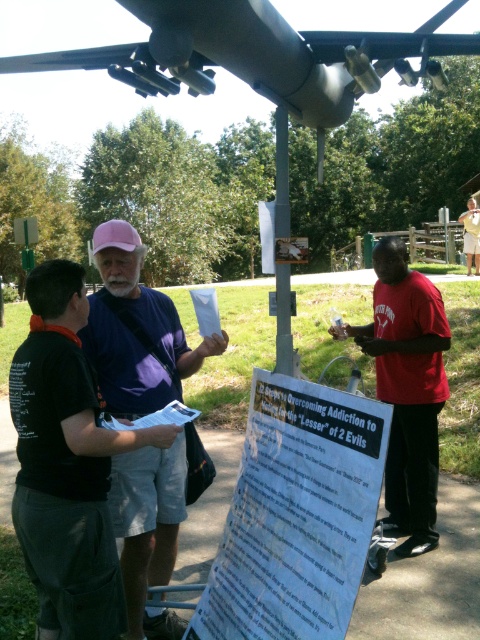
Question: Which object is farther from the camera taking this photo?

Choices:
 (A) matte red shirt at right
 (B) pink fabric cap at upper left

Answer: (A)

Question: Does pink fabric cap at upper left appear under metallic signpost at center?

Choices:
 (A) yes
 (B) no

Answer: (A)

Question: Can you confirm if matte red shirt at right is thinner than red shirt at right?

Choices:
 (A) yes
 (B) no

Answer: (A)

Question: Can you confirm if pink fabric cap at upper left is smaller than matte red shirt at right?

Choices:
 (A) no
 (B) yes

Answer: (A)

Question: Which object is the farthest from the red shirt at right?

Choices:
 (A) pink fabric cap at upper left
 (B) matte red shirt at right
 (C) metallic signpost at center

Answer: (A)

Question: Among these points, which one is nearest to the camera?

Choices:
 (A) (255, 576)
 (B) (288, 211)
 (C) (475, 252)

Answer: (A)